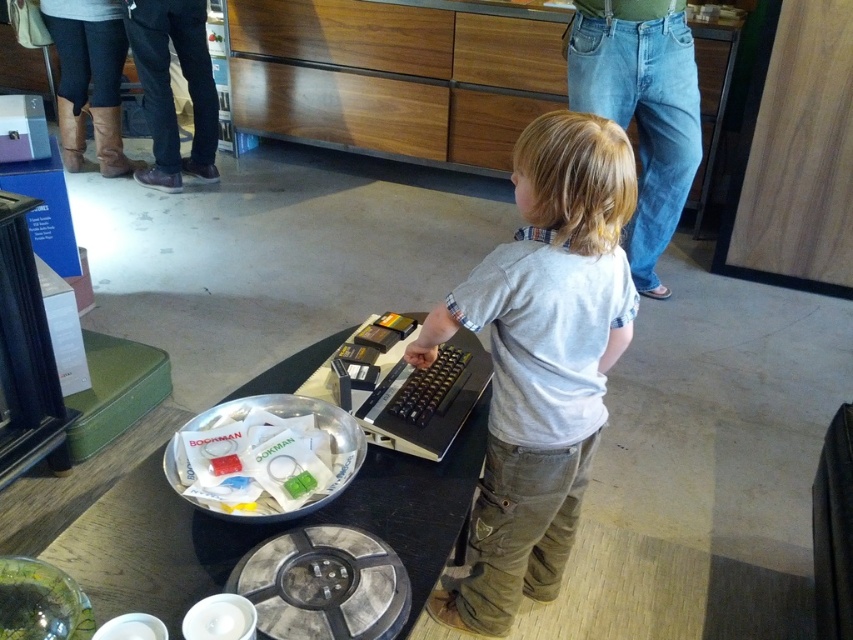
Question: Can you confirm if black glossy table at center is positioned to the left of white paper at center?

Choices:
 (A) no
 (B) yes

Answer: (A)

Question: Does light gray cotton shirt at center appear on the left side of black glossy table at center?

Choices:
 (A) yes
 (B) no

Answer: (B)

Question: Which point is closer to the camera taking this photo?

Choices:
 (A) (524, 404)
 (B) (248, 444)
 (C) (407, 492)

Answer: (B)

Question: Among these objects, which one is nearest to the camera?

Choices:
 (A) white paper at center
 (B) light gray cotton shirt at center

Answer: (A)

Question: Can you confirm if light gray cotton shirt at center is positioned to the left of white paper at center?

Choices:
 (A) no
 (B) yes

Answer: (A)

Question: Among these points, which one is farthest from the camera?

Choices:
 (A) (242, 486)
 (B) (387, 484)

Answer: (B)